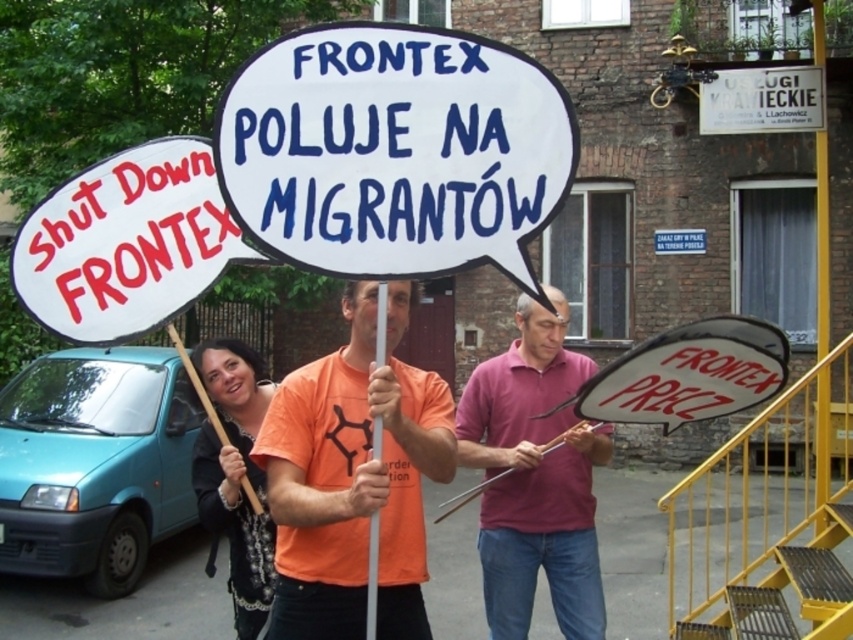
Between pink cotton shirt at center and black fabric shirt at center, which one has less height?

With less height is black fabric shirt at center.

Is point (498, 449) positioned after point (216, 346)?

Yes, it is.

What are the coordinates of `pink cotton shirt at center` in the screenshot? It's located at (534, 477).

In the scene shown: Is the position of orange t-shirt at center more distant than that of black fabric shirt at center?

That is False.

Is point (425, 433) closer to viewer compared to point (253, 400)?

Yes, it is.

Between point (339, 506) and point (245, 616), which one is positioned behind?

Point (245, 616)

Where is `orange t-shirt at center`? This screenshot has width=853, height=640. orange t-shirt at center is located at coordinates (352, 477).

Is point (316, 579) positioned in front of point (531, 593)?

Yes.

Measure the distance between point (346,436) and camera.

Point (346,436) is 2.79 meters away from camera.

Does point (422, 552) come in front of point (525, 304)?

Yes, point (422, 552) is closer to viewer.

I want to click on orange t-shirt at center, so click(352, 477).